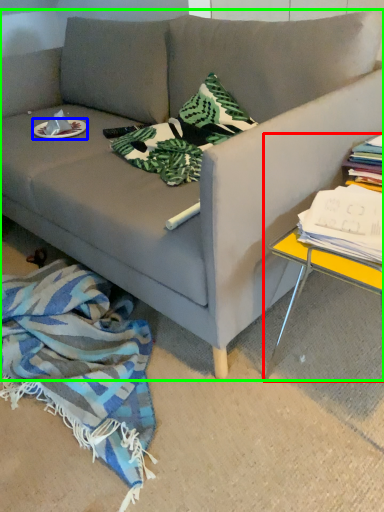
Question: Which object is positioned farthest from table (highlighted by a red box)? Select from plate (highlighted by a blue box) and studio couch (highlighted by a green box).

Choices:
 (A) plate
 (B) studio couch

Answer: (A)